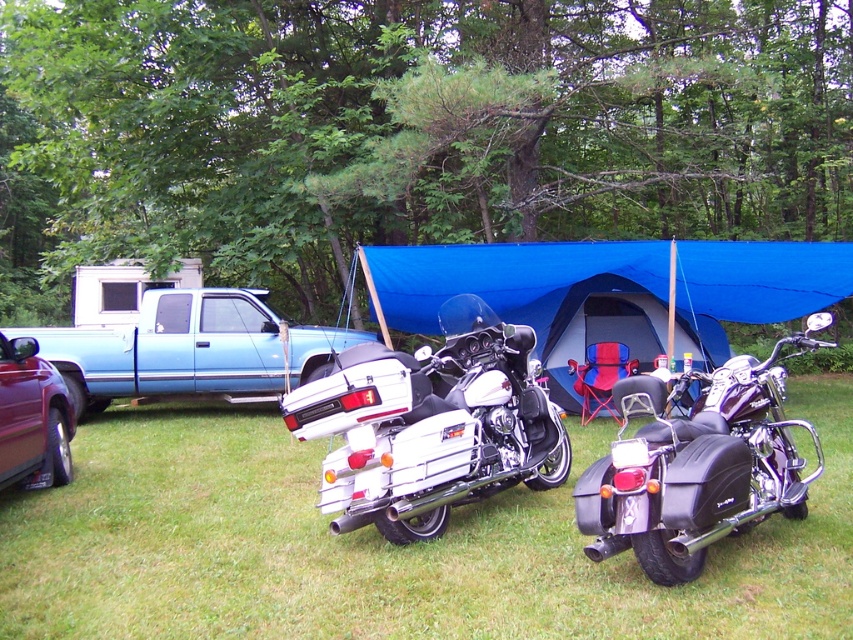
Question: Does blue fabric tent at center appear on the left side of metallic maroon car at lower left?

Choices:
 (A) yes
 (B) no

Answer: (B)

Question: Which point appears closest to the camera in this image?

Choices:
 (A) (433, 260)
 (B) (717, 394)
 (C) (57, 435)

Answer: (B)

Question: Estimate the real-world distances between objects in this image. Which object is closer to the green grass at center?

Choices:
 (A) metallic maroon car at lower left
 (B) blue fabric tent at center
 (C) white metallic motorcycle at center

Answer: (C)

Question: Does white metallic motorcycle at center have a smaller size compared to blue fabric tent at center?

Choices:
 (A) no
 (B) yes

Answer: (A)

Question: Is green grass at center bigger than white metallic motorcycle at center?

Choices:
 (A) no
 (B) yes

Answer: (B)

Question: Which of the following is the closest to the observer?

Choices:
 (A) black matte motorcycle at lower right
 (B) metallic maroon car at lower left
 (C) green grass at center
 (D) blue fabric tent at center

Answer: (C)